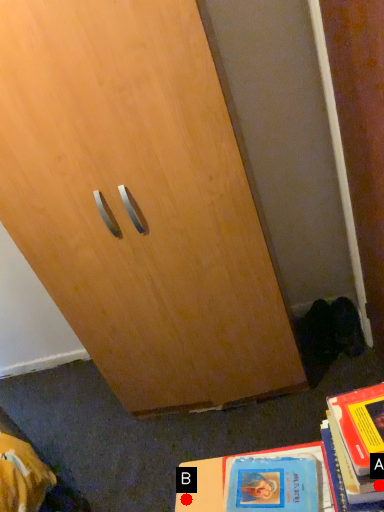
Question: Two points are circled on the image, labeled by A and B beside each circle. Which point is closer to the camera?

Choices:
 (A) A is closer
 (B) B is closer

Answer: (A)